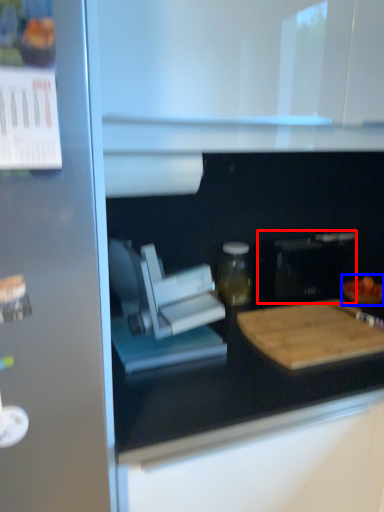
Question: Which of the following is the farthest to the observer, appliance (highlighted by a red box) or food (highlighted by a blue box)?

Choices:
 (A) appliance
 (B) food

Answer: (B)